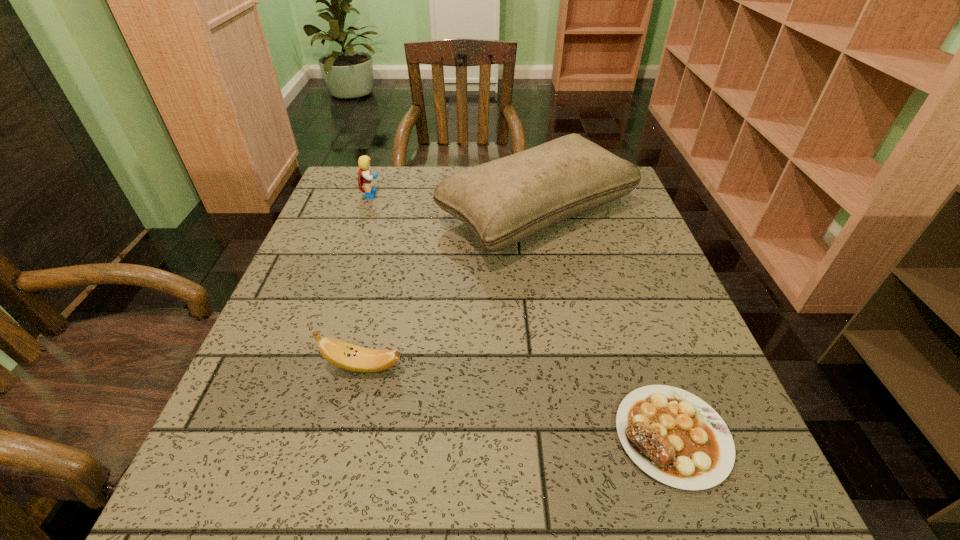
Where is `free space between the shortest object and the third shortest object`? Image resolution: width=960 pixels, height=540 pixels. free space between the shortest object and the third shortest object is located at coordinates (522, 315).

Locate an element on the screen. Image resolution: width=960 pixels, height=540 pixels. blank region between the nearest object and the third shortest object is located at coordinates (522, 315).

You are a GUI agent. You are given a task and a screenshot of the screen. Output one action in this format:
    pyautogui.click(x=<x>, y=<y>)
    Task: Click on the free space between the Lego and the shortest object
    The height and width of the screenshot is (540, 960).
    Given the screenshot: What is the action you would take?
    (522, 315)

Find the location of a particular element. The height and width of the screenshot is (540, 960). free point between the second tallest object and the banana is located at coordinates (368, 281).

Choose which object is the second nearest neighbor to the third tallest object. Please provide its 2D coordinates. Your answer should be formatted as a tuple, i.e. [(x, y)], where the tuple contains the x and y coordinates of a point satisfying the conditions above.

[(675, 437)]

Identify the location of the third closest object to the Lego. This screenshot has width=960, height=540. (675, 437).

At what (x,y) coordinates should I click in order to perform the action: click on vacant area in the image that satisfies the following two spatial constraints: 1. on the front-facing side of the third tallest object; 2. on the left side of the second tallest object. Please return your answer as a coordinate pair (x, y). The height and width of the screenshot is (540, 960). Looking at the image, I should click on (314, 367).

Image resolution: width=960 pixels, height=540 pixels. In order to click on free space that satisfies the following two spatial constraints: 1. on the front-facing side of the Lego; 2. on the back side of the shortest object in this screenshot , I will do pos(291,436).

You are a GUI agent. You are given a task and a screenshot of the screen. Output one action in this format:
    pyautogui.click(x=<x>, y=<y>)
    Task: Click on the free space in the image that satisfies the following two spatial constraints: 1. on the back side of the third tallest object; 2. on the left side of the tallest object
    The height and width of the screenshot is (540, 960).
    Given the screenshot: What is the action you would take?
    pyautogui.click(x=400, y=212)

The width and height of the screenshot is (960, 540). In order to click on blank area in the image that satisfies the following two spatial constraints: 1. on the front-facing side of the tallest object; 2. on the right side of the second tallest object in this screenshot , I will do `click(367, 212)`.